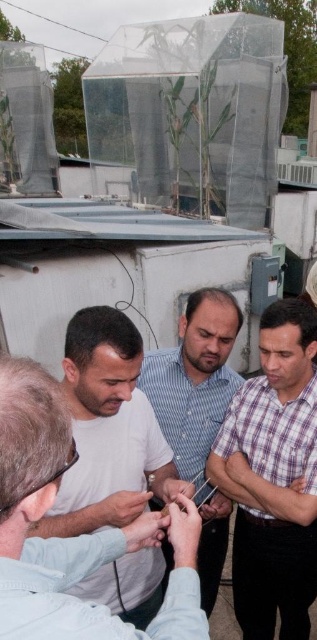
Question: Does plaid shirt at center appear on the right side of blue striped shirt at center?

Choices:
 (A) no
 (B) yes

Answer: (B)

Question: Can you confirm if plaid shirt at center is positioned to the left of blue striped shirt at center?

Choices:
 (A) yes
 (B) no

Answer: (B)

Question: Can you confirm if plaid shirt at center is positioned below white matte shirt at center?

Choices:
 (A) no
 (B) yes

Answer: (B)

Question: Which object appears closest to the camera in this image?

Choices:
 (A) plaid shirt at center
 (B) blue striped shirt at center

Answer: (A)

Question: Which object is the closest to the plaid shirt at center?

Choices:
 (A) blue striped shirt at center
 (B) white matte shirt at center

Answer: (A)

Question: Which object is the closest to the white matte shirt at center?

Choices:
 (A) plaid shirt at center
 (B) blue striped shirt at center

Answer: (B)